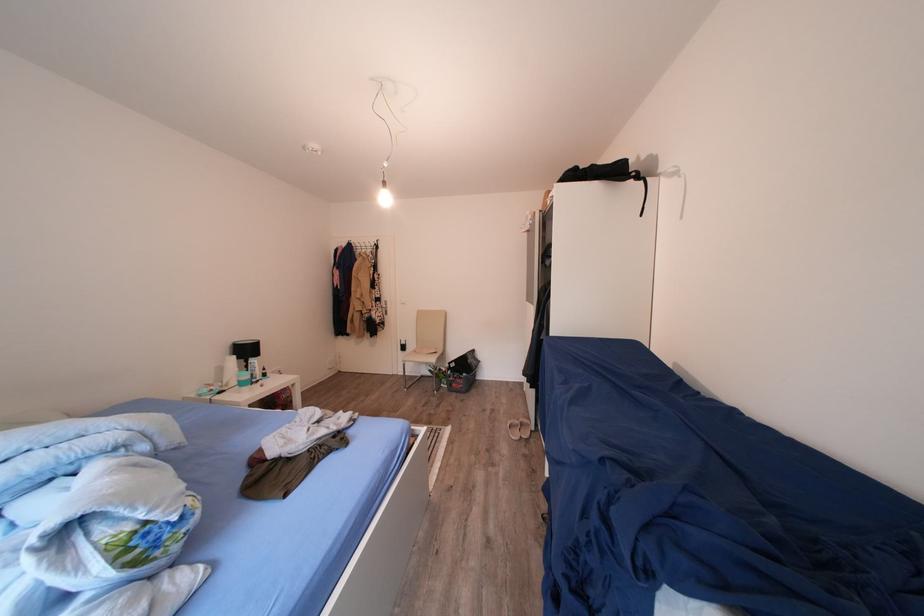
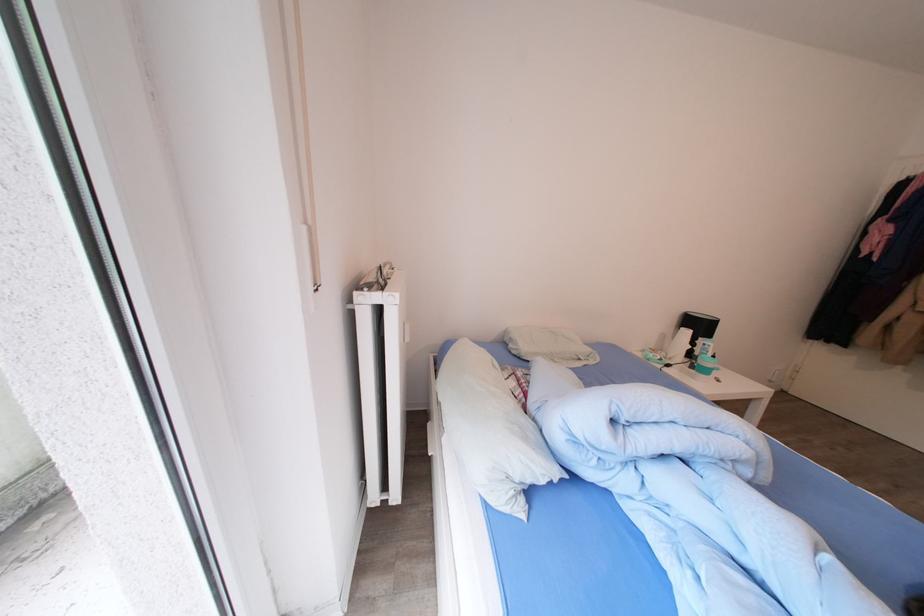
The point at (256, 355) is marked in the first image. Where is the corresponding point in the second image?

(708, 331)